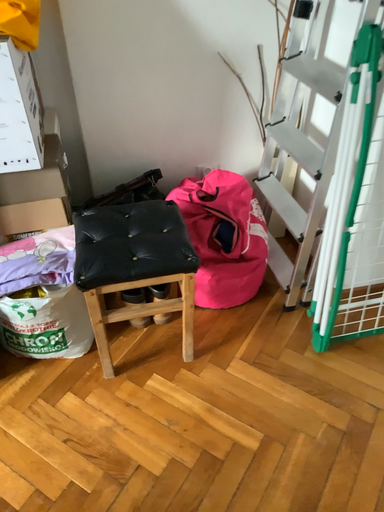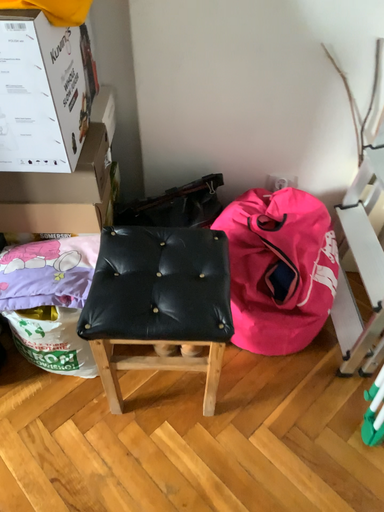
Question: Which way did the camera rotate in the video?

Choices:
 (A) rotated left
 (B) rotated right

Answer: (A)